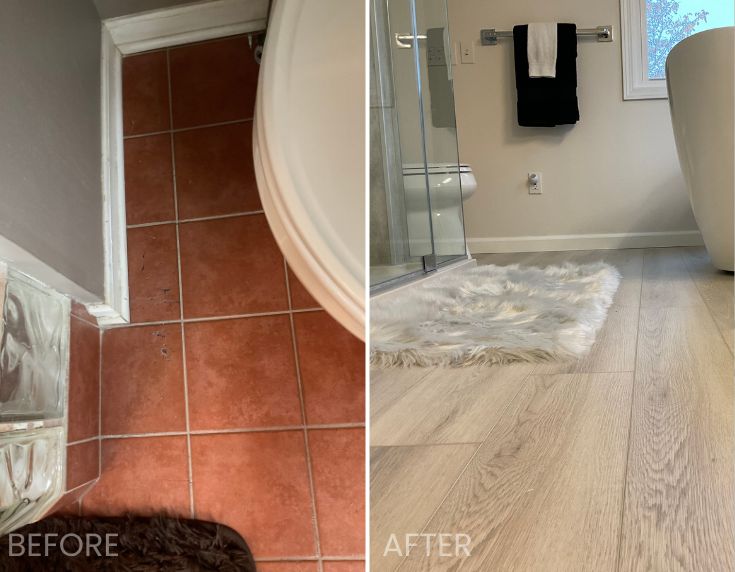
The image size is (735, 572). In order to click on baseboard in this screenshot , I will do `click(118, 189)`, `click(642, 241)`.